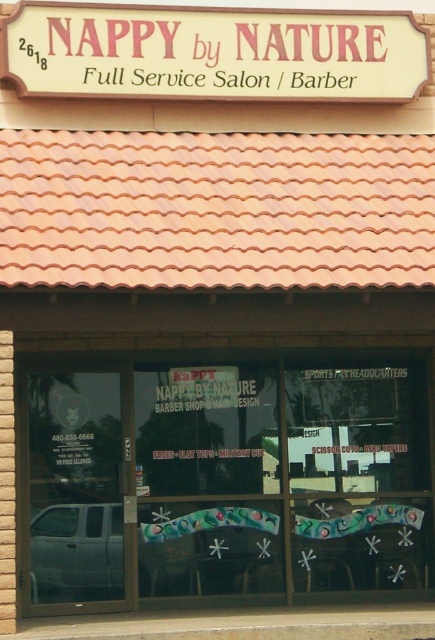
You are a customer approaching the entrance of Nappy by Nature. You want to see the interior through the transparent glass window at center while also reading the white matte sign at upper center. Which object should you look at first to see both?

You should look at the transparent glass window at center first because it is to the right of the white matte sign at upper center, so by starting at the window, you can glance left to see the sign as well.